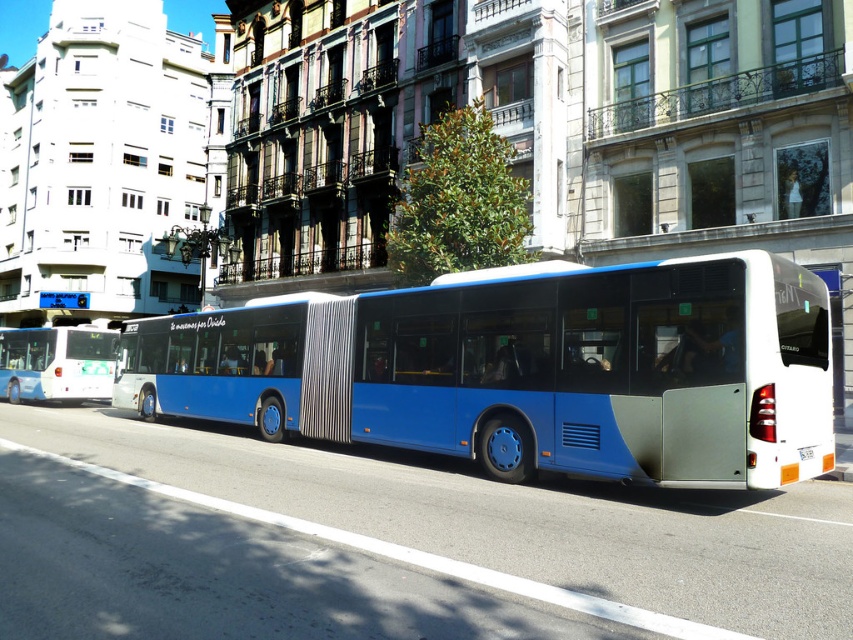
Question: Is blue metallic bus at center below white glossy bus at left?

Choices:
 (A) no
 (B) yes

Answer: (A)

Question: Considering the relative positions of blue metallic bus at center and white glossy bus at left in the image provided, where is blue metallic bus at center located with respect to white glossy bus at left?

Choices:
 (A) right
 (B) left

Answer: (A)

Question: Which point appears closest to the camera in this image?

Choices:
 (A) (9, 346)
 (B) (384, 358)

Answer: (B)

Question: Is blue metallic bus at center behind white glossy bus at left?

Choices:
 (A) no
 (B) yes

Answer: (A)

Question: Among these points, which one is nearest to the camera?

Choices:
 (A) (445, 428)
 (B) (19, 371)

Answer: (A)

Question: Which point is closer to the camera taking this photo?

Choices:
 (A) (83, 378)
 (B) (572, 384)

Answer: (B)